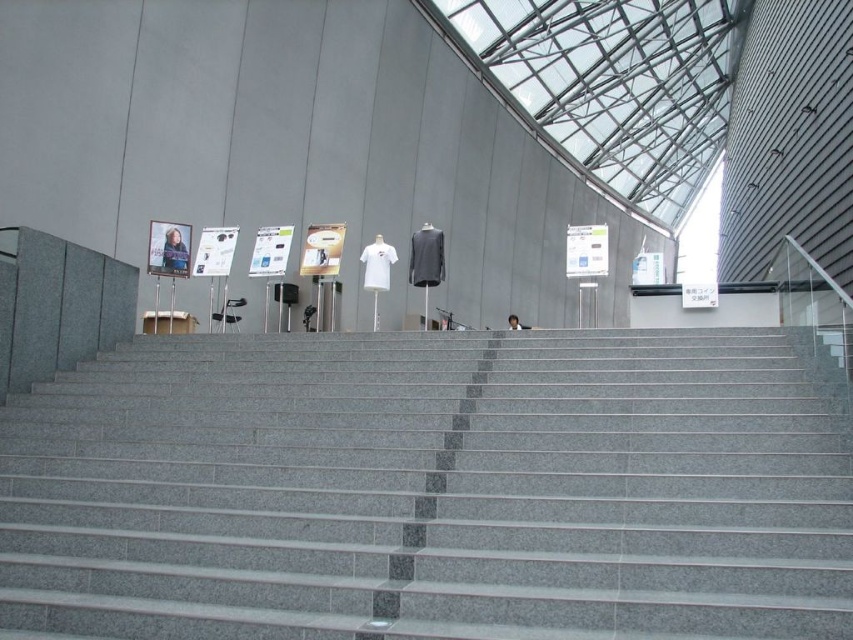
Question: Is white matte t-shirt at center positioned at the back of matte black poster at upper left?

Choices:
 (A) no
 (B) yes

Answer: (B)

Question: Considering the real-world distances, which object is closest to the white matte t-shirt at center?

Choices:
 (A) gray granite stairs at center
 (B) matte black poster at upper left
 (C) light brown hair at center

Answer: (B)

Question: Is gray granite stairs at center thinner than white matte t-shirt at center?

Choices:
 (A) no
 (B) yes

Answer: (B)

Question: Estimate the real-world distances between objects in this image. Which object is closer to the matte black poster at upper left?

Choices:
 (A) white matte t-shirt at center
 (B) gray granite stairs at center
 (C) light brown hair at center

Answer: (A)

Question: Which object is the farthest from the gray granite stairs at center?

Choices:
 (A) light brown hair at center
 (B) matte black poster at upper left

Answer: (A)

Question: Is gray granite stairs at center smaller than matte black poster at upper left?

Choices:
 (A) no
 (B) yes

Answer: (B)